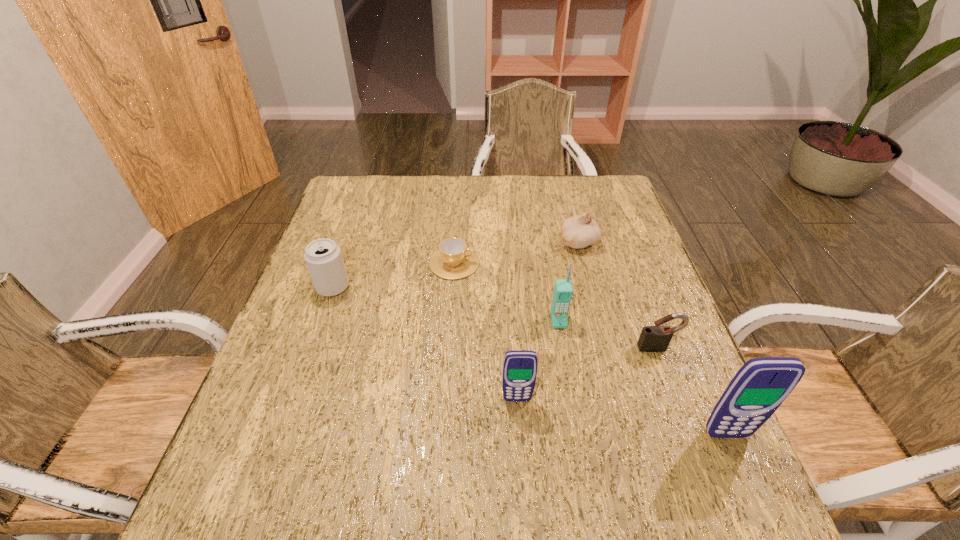
Identify the location of the leftmost cellular telephone. The height and width of the screenshot is (540, 960). (519, 367).

You are a GUI agent. You are given a task and a screenshot of the screen. Output one action in this format:
    pyautogui.click(x=<x>, y=<y>)
    Task: Click on the third object from left to right
    
    Given the screenshot: What is the action you would take?
    pyautogui.click(x=519, y=367)

You are a GUI agent. You are given a task and a screenshot of the screen. Output one action in this format:
    pyautogui.click(x=<x>, y=<y>)
    Task: Click on the nearest cellular telephone
    The width and height of the screenshot is (960, 540).
    Given the screenshot: What is the action you would take?
    pyautogui.click(x=761, y=385)

Where is `the tallest cellular telephone`? the tallest cellular telephone is located at coordinates (761, 385).

The height and width of the screenshot is (540, 960). In order to click on garlic in this screenshot , I will do `click(580, 231)`.

Locate an element on the screen. This screenshot has width=960, height=540. the leftmost object is located at coordinates (323, 257).

Where is `the fourth nearest object`? The image size is (960, 540). the fourth nearest object is located at coordinates (563, 291).

What are the coordinates of `the second cellular telephone from right to left` in the screenshot? It's located at (563, 291).

You are a GUI agent. You are given a task and a screenshot of the screen. Output one action in this format:
    pyautogui.click(x=<x>, y=<y>)
    Task: Click on the cup
    
    Given the screenshot: What is the action you would take?
    pyautogui.click(x=454, y=260)

Locate an element on the screen. The height and width of the screenshot is (540, 960). the sixth object from right to left is located at coordinates (454, 260).